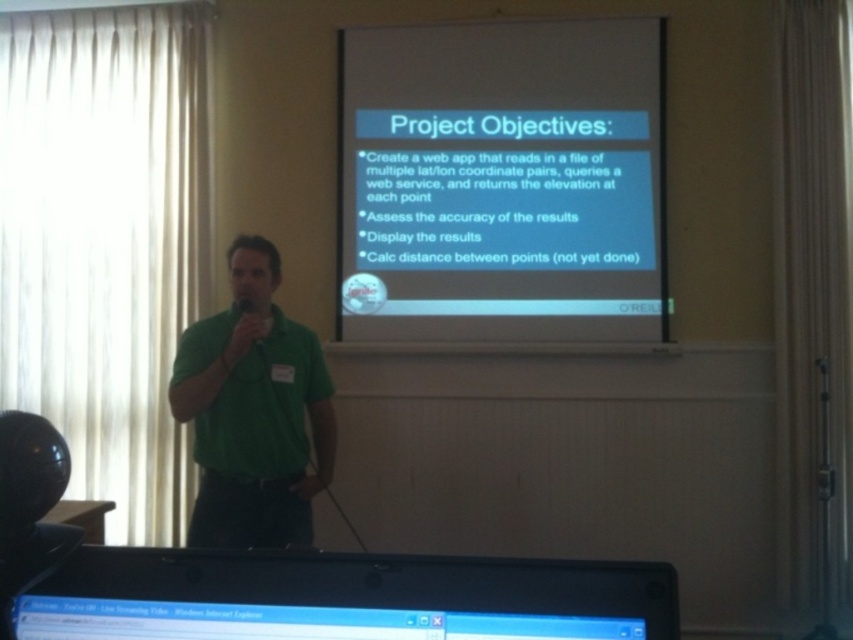
Based on the scene description, can you determine if the white matte projector screen at upper center is wider than the black plastic monitor at lower center?

The white matte projector screen at upper center might be wider than black plastic monitor at lower center according to the description.